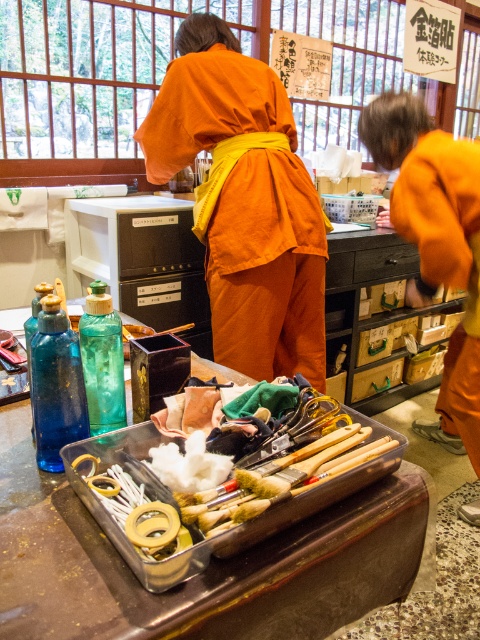
You are organizing a craft station and need to place both the blue glass bottle at center and the translucent green glass bottle at center on a shelf. The shelf has a height limit of 10 cm. Which bottle should you place on the shelf to ensure it doesn not exceed the height limit?

The translucent green glass bottle at center is above the blue glass bottle at center, so the blue glass bottle at center is shorter and can be placed on the shelf without exceeding the height limit.